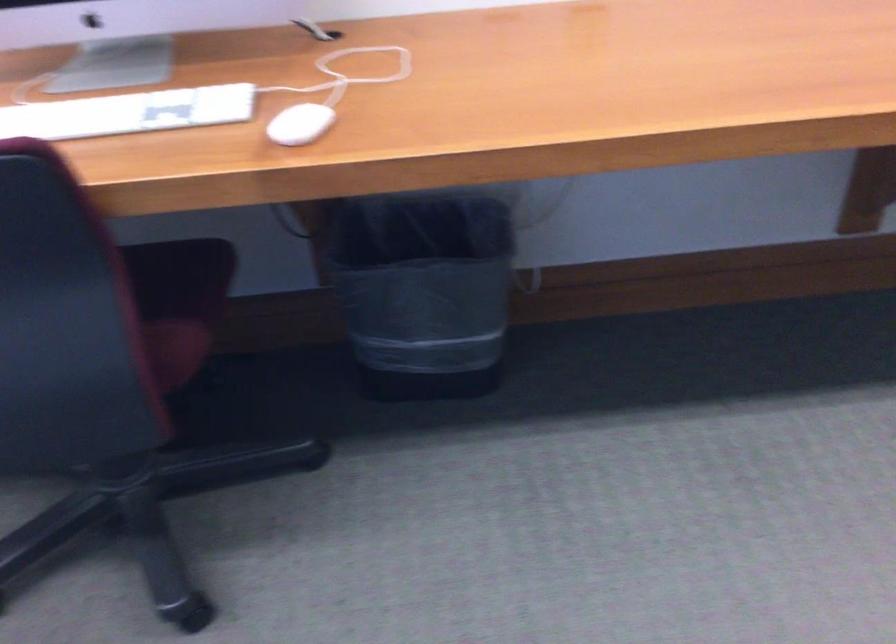
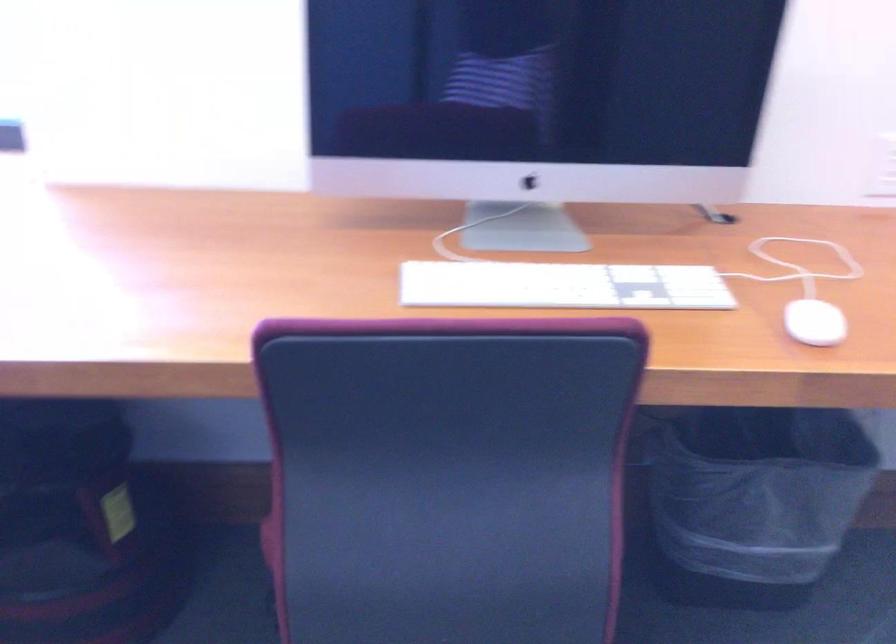
Question: In a continuous first-person perspective shot, in which direction is the camera moving?

Choices:
 (A) Left
 (B) Right
 (C) Forward
 (D) Backward

Answer: (A)